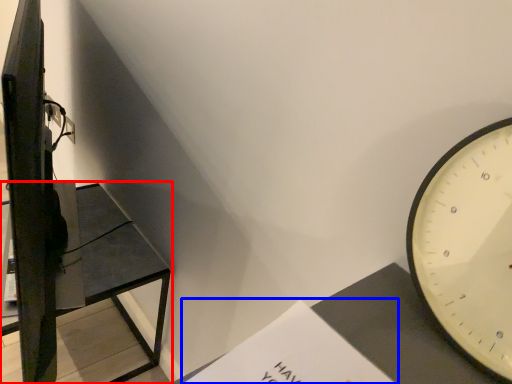
Question: Which object is closer to the camera taking this photo, furniture (highlighted by a red box) or paperback book (highlighted by a blue box)?

Choices:
 (A) furniture
 (B) paperback book

Answer: (B)